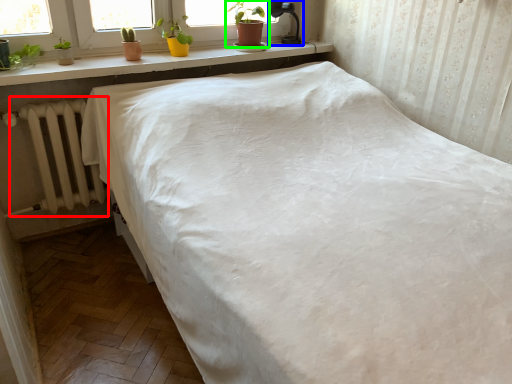
Question: Based on their relative distances, which object is nearer to radiator (highlighted by a red box)? Choose from lamp (highlighted by a blue box) and houseplant (highlighted by a green box).

Choices:
 (A) lamp
 (B) houseplant

Answer: (B)